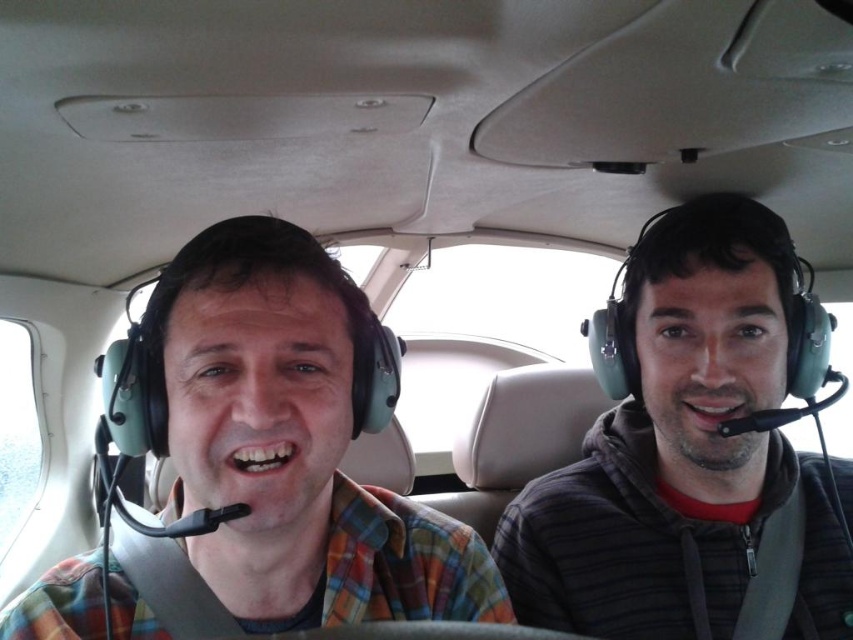
Can you confirm if matte green headset at left is smaller than gray striped hoodie at right?

Indeed, matte green headset at left has a smaller size compared to gray striped hoodie at right.

Based on the photo, does matte green headset at left come behind gray striped hoodie at right?

No, it is not.

At what (x,y) coordinates should I click in order to perform the action: click on matte green headset at left. Please return your answer as a coordinate pair (x, y). Looking at the image, I should click on (292, 444).